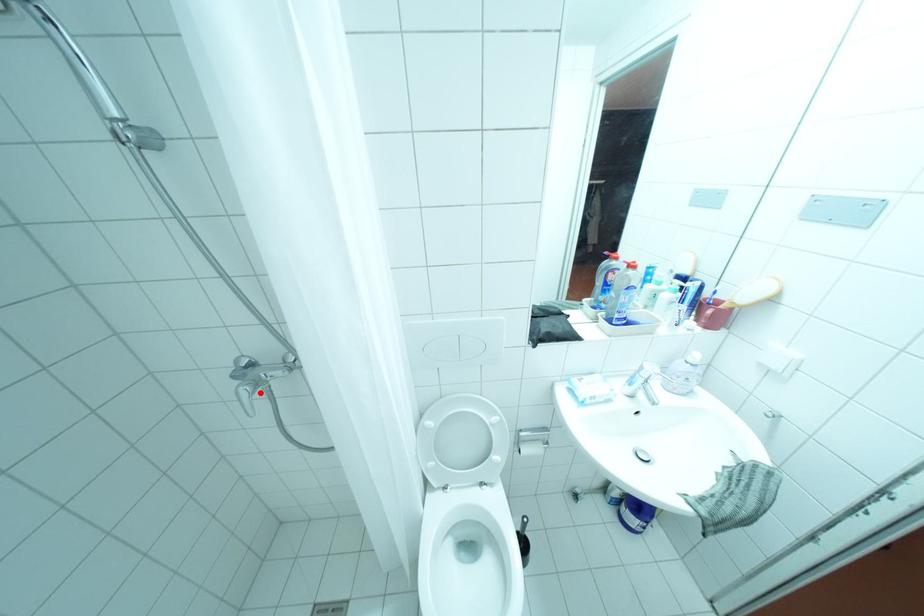
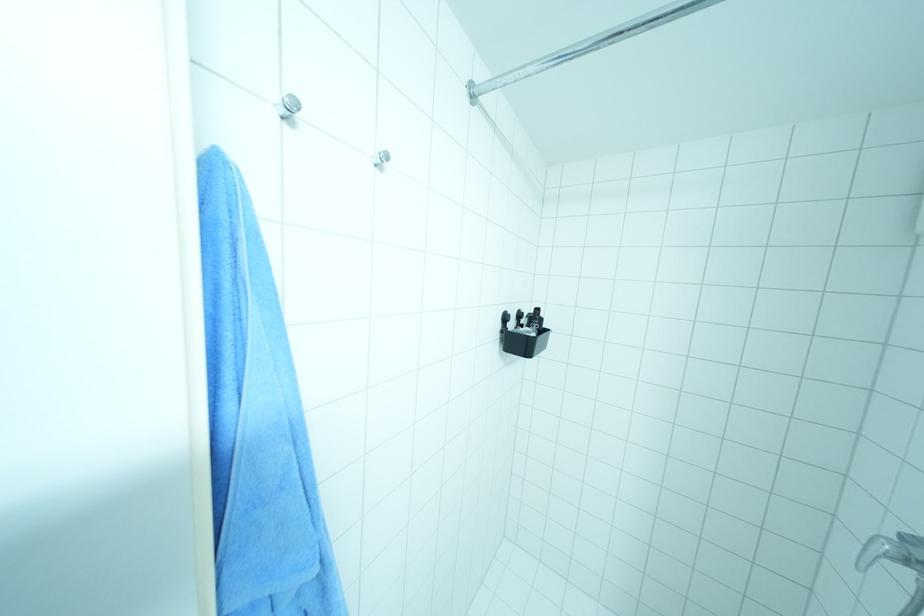
The point at the highlighted location is marked in the first image. Where is the corresponding point in the second image?

(898, 557)